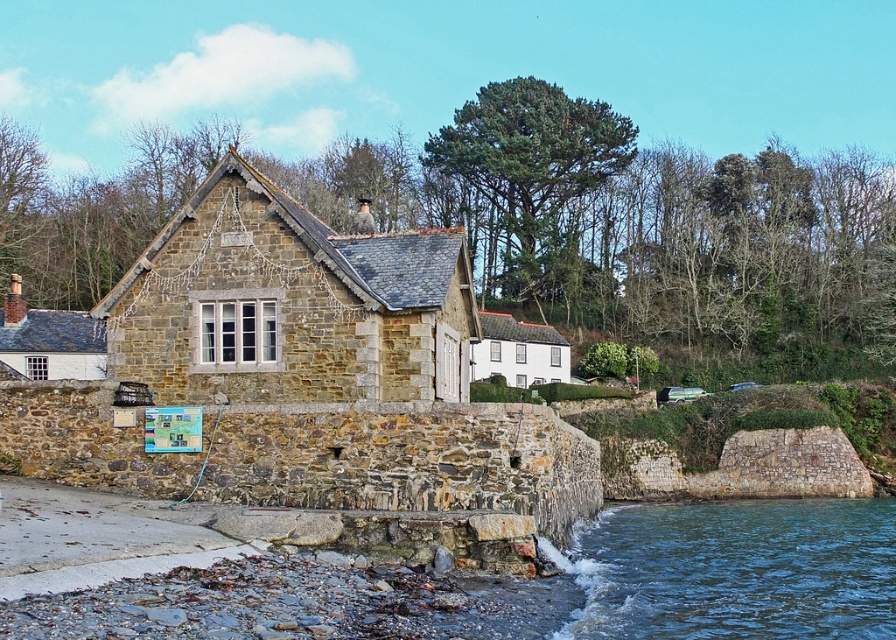
Who is more distant from viewer, (100, 326) or (556, 356)?

The point (556, 356) is behind.

Between point (37, 332) and point (493, 326), which one is positioned behind?

Point (493, 326)

Identify the location of matte stone cottage at left. The image size is (896, 640). (49, 340).

Is blue liquid water at lower right wider than matte stone cottage at left?

Yes.

Describe the element at coordinates (737, 570) in the screenshot. I see `blue liquid water at lower right` at that location.

Which is in front, point (731, 580) or point (41, 333)?

Point (731, 580) is more forward.

I want to click on blue liquid water at lower right, so click(737, 570).

You are a GUI agent. You are given a task and a screenshot of the screen. Output one action in this format:
    pyautogui.click(x=<x>, y=<y>)
    Task: Click on the stone cottage at center
    The height and width of the screenshot is (640, 896).
    Given the screenshot: What is the action you would take?
    pyautogui.click(x=290, y=304)

Who is more forward, (311, 387) or (547, 378)?

Positioned in front is point (311, 387).

Between point (108, 316) and point (564, 356), which one is positioned behind?

Positioned behind is point (564, 356).

Where is `stone cottage at center`? stone cottage at center is located at coordinates (290, 304).